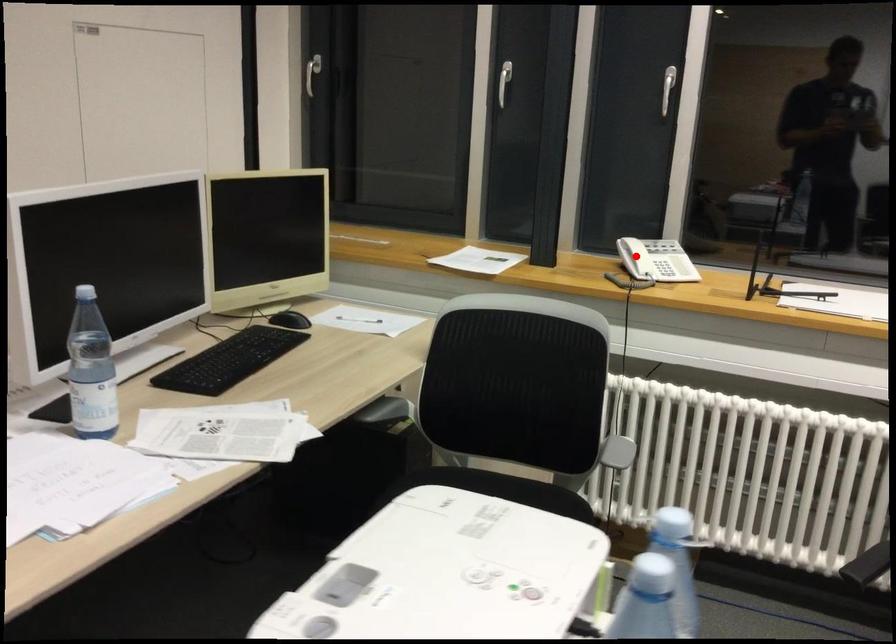
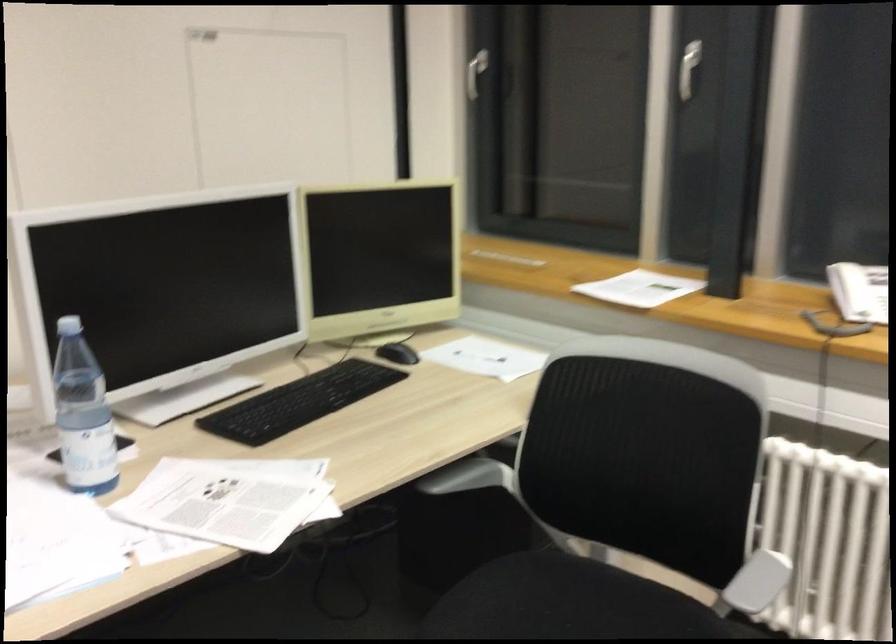
Locate, in the second image, the point that corresponds to the highlighted location in the first image.

(850, 290)